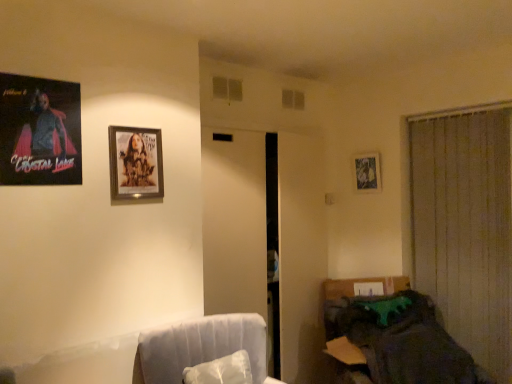
Question: Is matte black poster at upper left, arranged as the first picture frame when viewed from the left, wider or thinner than white fabric swivel chair at lower left?

Choices:
 (A) thin
 (B) wide

Answer: (A)

Question: Is matte black poster at upper left, marked as the 3th picture frame in a back-to-front arrangement, taller or shorter than white fabric swivel chair at lower left?

Choices:
 (A) short
 (B) tall

Answer: (B)

Question: Estimate the real-world distances between objects in this image. Which object is closer to the beige fabric curtain at right?

Choices:
 (A) metallic silver picture frame at upper right, the 3th picture frame positioned from the left
 (B) dark fabric couch at lower right
 (C) matte black poster at upper left, which is the 3th picture frame in right-to-left order
 (D) wooden frame at upper center, the 2th picture frame in the front-to-back sequence
 (E) white fabric swivel chair at lower left

Answer: (B)

Question: Which of these objects is positioned closest to the metallic silver picture frame at upper right, the 3th picture frame positioned from the left?

Choices:
 (A) white fabric swivel chair at lower left
 (B) beige fabric curtain at right
 (C) matte black poster at upper left, arranged as the first picture frame when viewed from the left
 (D) wooden frame at upper center, the second picture frame from the left
 (E) dark fabric couch at lower right

Answer: (B)